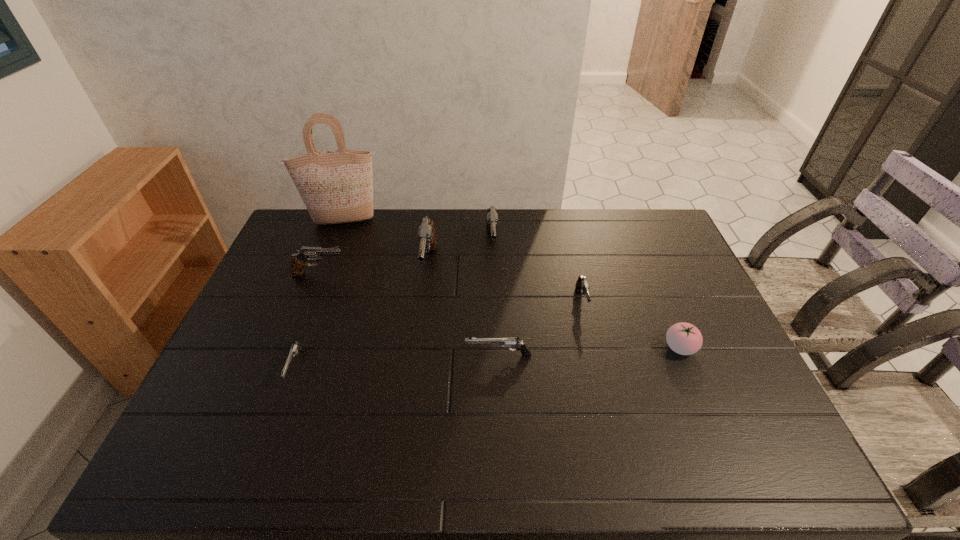
At what (x,y) coordinates should I click in order to perform the action: click on free point between the left silver pistol and the leftmost gray pistol. Please return your answer as a coordinate pair (x, y). This screenshot has width=960, height=540. Looking at the image, I should click on (307, 320).

The width and height of the screenshot is (960, 540). Find the location of `empty space between the second object from right to left and the smaller silver pistol`. empty space between the second object from right to left and the smaller silver pistol is located at coordinates (439, 334).

Locate an element on the screen. Image resolution: width=960 pixels, height=540 pixels. free spot between the red tomato and the bigger silver pistol is located at coordinates (589, 352).

The height and width of the screenshot is (540, 960). In order to click on free space that is in between the rightmost pistol and the tomato in this screenshot , I will do `click(631, 325)`.

Image resolution: width=960 pixels, height=540 pixels. I want to click on free spot between the bigger silver pistol and the third biggest gray pistol, so click(409, 315).

Locate an element on the screen. The height and width of the screenshot is (540, 960). object identified as the fifth closest to the third gray pistol from left to right is located at coordinates (299, 260).

Point out which object is positioned as the fourth nearest to the fourth shortest pistol. Please provide its 2D coordinates. Your answer should be formatted as a tuple, i.e. [(x, y)], where the tuple contains the x and y coordinates of a point satisfying the conditions above.

[(492, 217)]

Identify which pistol is the third closest to the shortest object. Please provide its 2D coordinates. Your answer should be formatted as a tuple, i.e. [(x, y)], where the tuple contains the x and y coordinates of a point satisfying the conditions above.

[(505, 342)]

Choose which pistol is the third nearest neighbor to the red tomato. Please provide its 2D coordinates. Your answer should be formatted as a tuple, i.e. [(x, y)], where the tuple contains the x and y coordinates of a point satisfying the conditions above.

[(492, 217)]

Select which gray pistol appears as the closest to the third smallest gray pistol. Please provide its 2D coordinates. Your answer should be formatted as a tuple, i.e. [(x, y)], where the tuple contains the x and y coordinates of a point satisfying the conditions above.

[(426, 236)]